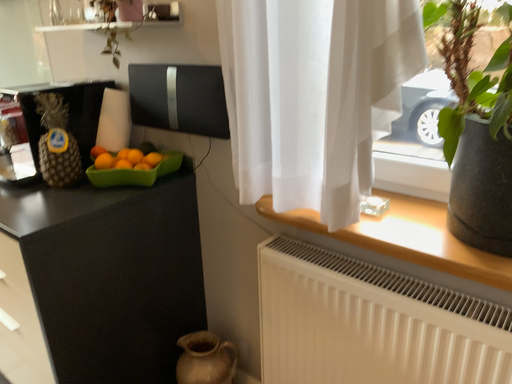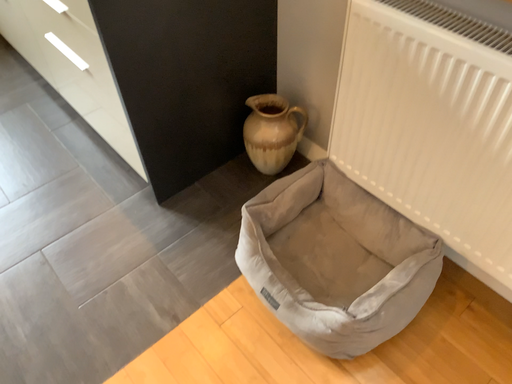
Question: How did the camera likely rotate when shooting the video?

Choices:
 (A) rotated downward
 (B) rotated upward

Answer: (A)